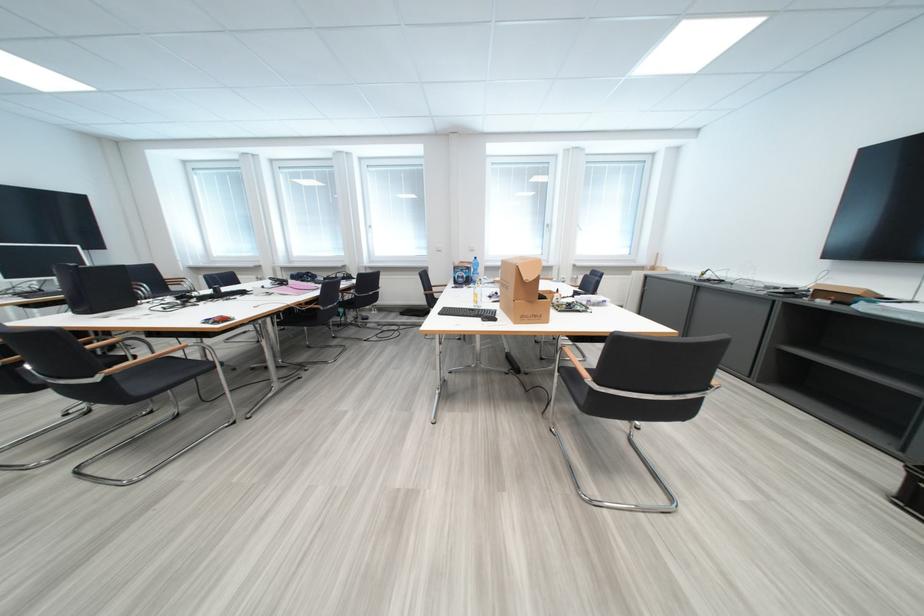
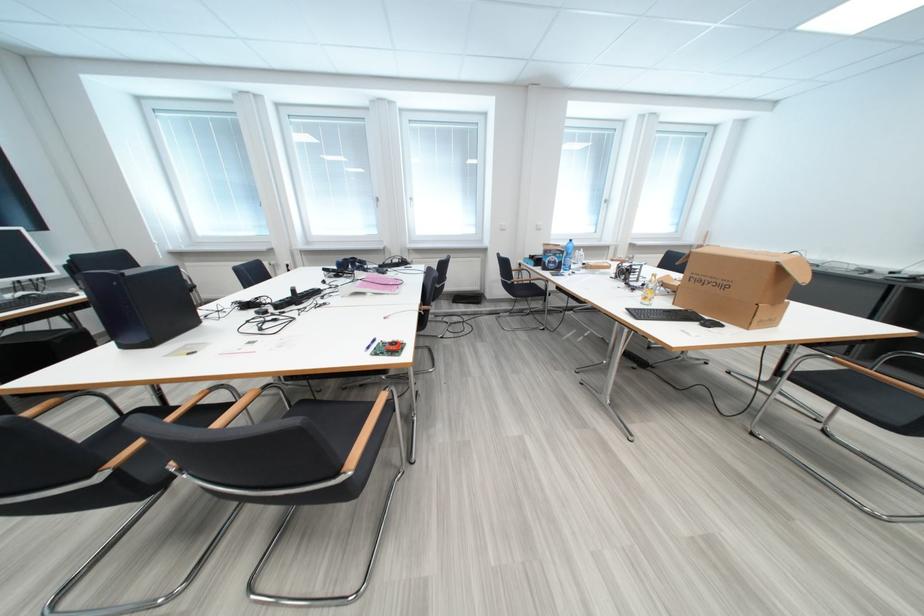
Find the pixel in the second image that matches (88,315) in the first image.

(136, 349)